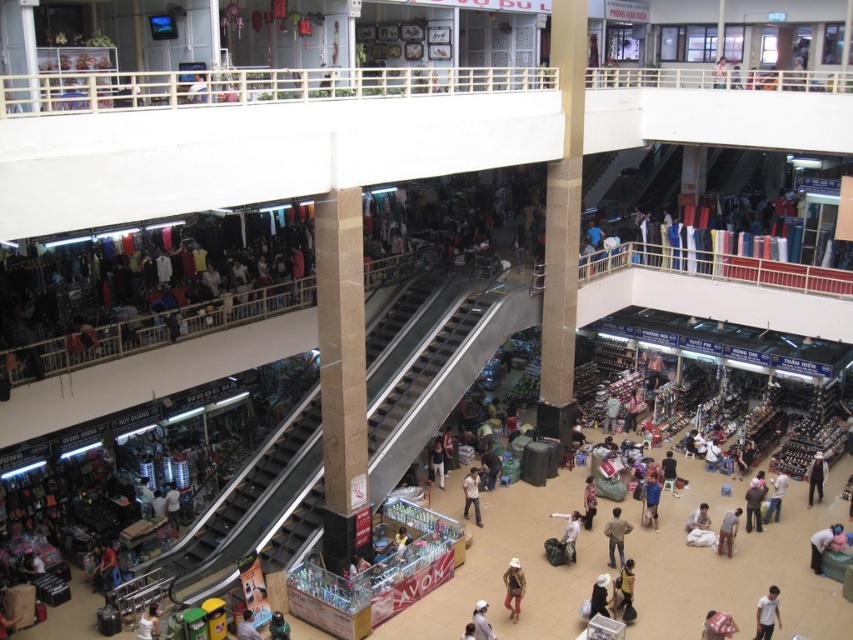
You are a store manager organizing a display. You have two items to place on a shelf that can only hold items up to 1.2 meters in height. The light brown leather jacket at center and the light brown leather pants at lower right. Based on their sizes, which item will fit on the shelf?

The light brown leather jacket at center has a greater height compared to light brown leather pants at lower right. Since the shelf can only hold items up to 1.2 meters, if the jacket is taller than 1.2 meters, it won t fit, but the pants might. However, without specific measurements, we can only say that the jacket is taller, so if the pants are under 1.2m, they fit, but the jacket s eligibility depends on its actual height.

You are a delivery robot with a 1.2 meter wide package. You need to transport this package from the light brown leather jacket at center to the light brown leather pants at lower right. Can you safely move the package through the space between them?

The distance between the light brown leather jacket at center and the light brown leather pants at lower right is 5.73 meters. Since the package is only 1.2 meters wide, there is sufficient space for the robot to navigate the 5.73 meter gap safely.

You are standing at the entrance of the shopping mall and want to reach a specific point marked at coordinates point [811,554]. Given that the mall has escalators and staircases connecting different levels, can you estimate how far you need to walk or travel to reach that point?

The distance of point [811,554] from viewer is 123.10 feet, so you need to travel approximately 123.10 feet to reach that point.